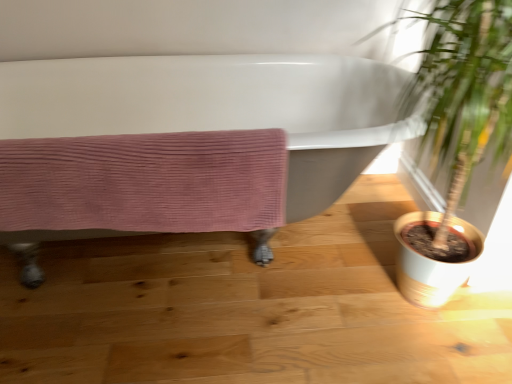
Question: Is green leafy plant at right positioned beyond the bounds of pink corduroy towel at lower left?

Choices:
 (A) yes
 (B) no

Answer: (A)

Question: Is green leafy plant at right facing towards pink corduroy towel at lower left?

Choices:
 (A) no
 (B) yes

Answer: (A)

Question: From a real-world perspective, is green leafy plant at right beneath pink corduroy towel at lower left?

Choices:
 (A) yes
 (B) no

Answer: (B)

Question: Is green leafy plant at right not close to pink corduroy towel at lower left?

Choices:
 (A) yes
 (B) no

Answer: (B)

Question: Is green leafy plant at right to the right of pink corduroy towel at lower left from the viewer's perspective?

Choices:
 (A) yes
 (B) no

Answer: (A)

Question: Considering the positions of green leafy plant at right and pink corduroy towel at lower left in the image, is green leafy plant at right bigger or smaller than pink corduroy towel at lower left?

Choices:
 (A) small
 (B) big

Answer: (B)

Question: Would you say green leafy plant at right is inside or outside pink corduroy towel at lower left?

Choices:
 (A) outside
 (B) inside

Answer: (A)

Question: Is green leafy plant at right wider or thinner than pink corduroy towel at lower left?

Choices:
 (A) wide
 (B) thin

Answer: (A)

Question: Is green leafy plant at right in front of or behind pink corduroy towel at lower left in the image?

Choices:
 (A) behind
 (B) front

Answer: (B)

Question: In terms of size, does white glossy bathtub at center appear bigger or smaller than green leafy plant at right?

Choices:
 (A) big
 (B) small

Answer: (A)

Question: Would you say white glossy bathtub at center is to the left or to the right of green leafy plant at right in the picture?

Choices:
 (A) left
 (B) right

Answer: (A)

Question: In terms of height, does white glossy bathtub at center look taller or shorter compared to green leafy plant at right?

Choices:
 (A) short
 (B) tall

Answer: (A)

Question: Is white glossy bathtub at center spatially inside green leafy plant at right, or outside of it?

Choices:
 (A) inside
 (B) outside

Answer: (B)

Question: Does point (254, 168) appear closer or farther from the camera than point (431, 273)?

Choices:
 (A) closer
 (B) farther

Answer: (A)

Question: Visually, is pink corduroy towel at lower left positioned to the left or to the right of green leafy plant at right?

Choices:
 (A) right
 (B) left

Answer: (B)